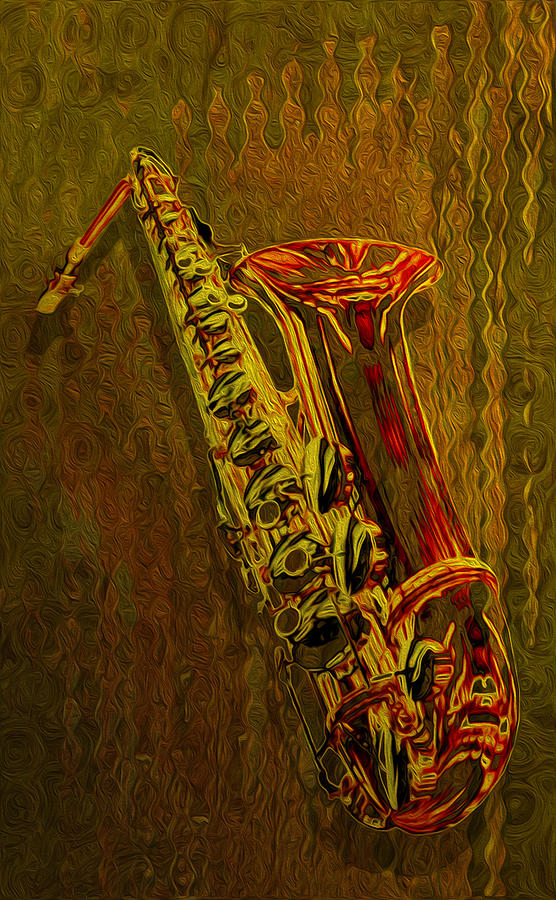
Image resolution: width=556 pixels, height=900 pixels. I want to click on keys, so click(x=292, y=625), click(x=290, y=565), click(x=273, y=516), click(x=219, y=294), click(x=188, y=259), click(x=185, y=263).